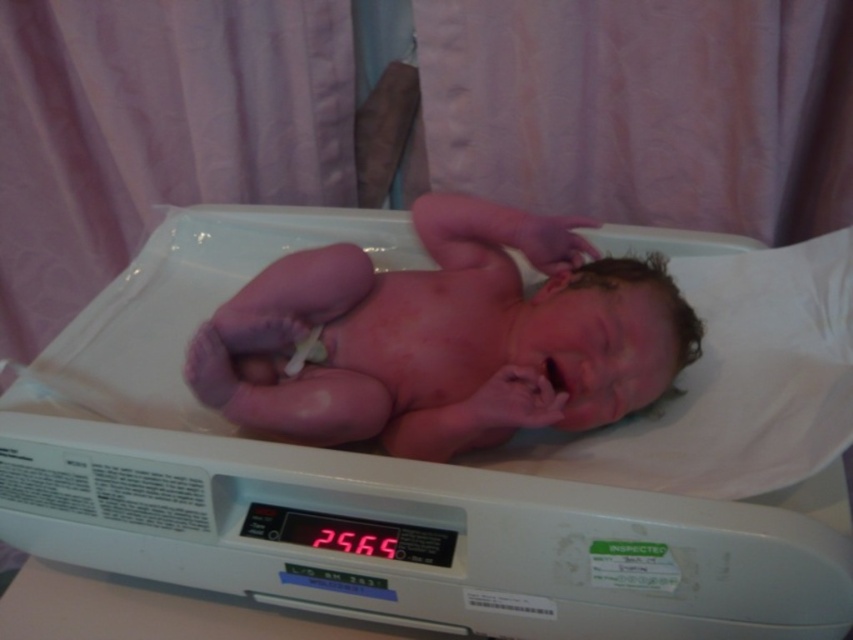
Question: Does white plastic scale at center lie behind pink smooth skin at center?

Choices:
 (A) no
 (B) yes

Answer: (A)

Question: Considering the relative positions of white plastic scale at center and pink smooth skin at center in the image provided, where is white plastic scale at center located with respect to pink smooth skin at center?

Choices:
 (A) above
 (B) below

Answer: (B)

Question: Does white plastic scale at center appear on the right side of pink smooth skin at center?

Choices:
 (A) yes
 (B) no

Answer: (B)